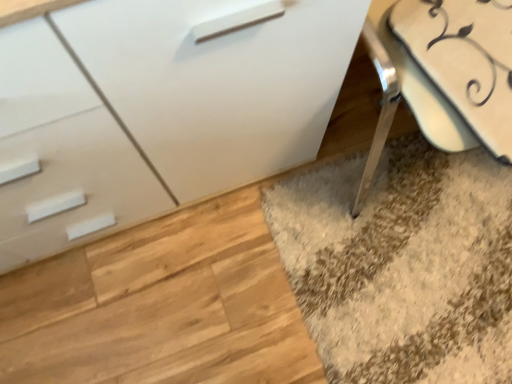
Where is `white glossy swivel chair at lower right`? This screenshot has height=384, width=512. white glossy swivel chair at lower right is located at coordinates (446, 68).

What do you see at coordinates (446, 68) in the screenshot? I see `white glossy swivel chair at lower right` at bounding box center [446, 68].

Image resolution: width=512 pixels, height=384 pixels. What do you see at coordinates (159, 108) in the screenshot?
I see `white glossy chest of drawers at center` at bounding box center [159, 108].

You are a GUI agent. You are given a task and a screenshot of the screen. Output one action in this format:
    pyautogui.click(x=<x>, y=<y>)
    Task: Click on the white glossy chest of drawers at center
    Image resolution: width=512 pixels, height=384 pixels.
    Given the screenshot: What is the action you would take?
    click(x=159, y=108)

Find the location of a particular element. The image size is (512, 384). white glossy swivel chair at lower right is located at coordinates (446, 68).

Is white glossy chest of drawers at center at the left side of white glossy swivel chair at lower right?

Correct, you'll find white glossy chest of drawers at center to the left of white glossy swivel chair at lower right.

Is white glossy chest of drawers at center further to the viewer compared to white glossy swivel chair at lower right?

No, white glossy chest of drawers at center is in front of white glossy swivel chair at lower right.

Considering the positions of points (12, 253) and (495, 106), is point (12, 253) farther from camera compared to point (495, 106)?

Yes, it is behind point (495, 106).

From the image's perspective, is white glossy chest of drawers at center positioned above or below white glossy swivel chair at lower right?

white glossy chest of drawers at center is situated lower than white glossy swivel chair at lower right in the image.

From a real-world perspective, which is physically above, white glossy chest of drawers at center or white glossy swivel chair at lower right?

From a 3D spatial view, white glossy swivel chair at lower right is above.

Which object is thinner, white glossy chest of drawers at center or white glossy swivel chair at lower right?

white glossy chest of drawers at center.

Who is taller, white glossy chest of drawers at center or white glossy swivel chair at lower right?

white glossy chest of drawers at center is taller.

Considering the sizes of white glossy chest of drawers at center and white glossy swivel chair at lower right in the image, is white glossy chest of drawers at center bigger or smaller than white glossy swivel chair at lower right?

white glossy chest of drawers at center is bigger than white glossy swivel chair at lower right.

Is white glossy chest of drawers at center located outside white glossy swivel chair at lower right?

Yes, white glossy chest of drawers at center is located beyond the bounds of white glossy swivel chair at lower right.

Is white glossy chest of drawers at center positioned far away from white glossy swivel chair at lower right?

No, white glossy chest of drawers at center is not far away from white glossy swivel chair at lower right.

Is white glossy chest of drawers at center facing away from white glossy swivel chair at lower right?

No, white glossy chest of drawers at center is not facing the opposite direction of white glossy swivel chair at lower right.

How much distance is there between white glossy chest of drawers at center and white glossy swivel chair at lower right?

white glossy chest of drawers at center is 14.32 inches from white glossy swivel chair at lower right.

Image resolution: width=512 pixels, height=384 pixels. In order to click on swivel chair on the right of white glossy chest of drawers at center in this screenshot , I will do `click(446, 68)`.

Can you confirm if white glossy swivel chair at lower right is positioned to the left of white glossy chest of drawers at center?

No, white glossy swivel chair at lower right is not to the left of white glossy chest of drawers at center.

Is white glossy swivel chair at lower right positioned before white glossy chest of drawers at center?

That is False.

Is point (386, 89) closer or farther from the camera than point (11, 263)?

Point (386, 89) appears to be closer to the viewer than point (11, 263).

From the image's perspective, relative to white glossy chest of drawers at center, is white glossy swivel chair at lower right above or below?

white glossy swivel chair at lower right is above white glossy chest of drawers at center.

From a real-world perspective, is white glossy swivel chair at lower right physically located above or below white glossy chest of drawers at center?

white glossy swivel chair at lower right is situated higher than white glossy chest of drawers at center in the real world.

Which of these two, white glossy swivel chair at lower right or white glossy chest of drawers at center, is thinner?

white glossy chest of drawers at center.

Between white glossy swivel chair at lower right and white glossy chest of drawers at center, which one has more height?

Standing taller between the two is white glossy chest of drawers at center.

Which of these two, white glossy swivel chair at lower right or white glossy chest of drawers at center, is bigger?

Bigger between the two is white glossy chest of drawers at center.

From the picture: Is white glossy swivel chair at lower right not within white glossy chest of drawers at center?

That's correct, white glossy swivel chair at lower right is outside of white glossy chest of drawers at center.

Is white glossy swivel chair at lower right not close to white glossy chest of drawers at center?

No, white glossy swivel chair at lower right is not far away from white glossy chest of drawers at center.

Is white glossy swivel chair at lower right positioned with its back to white glossy chest of drawers at center?

No.

Measure the distance from white glossy swivel chair at lower right to white glossy chest of drawers at center.

white glossy swivel chair at lower right is 14.32 inches away from white glossy chest of drawers at center.

I want to click on swivel chair behind the white glossy chest of drawers at center, so click(446, 68).

Locate an element on the screen. chest of drawers in front of the white glossy swivel chair at lower right is located at coordinates (159, 108).

The width and height of the screenshot is (512, 384). In order to click on swivel chair lying on the right of white glossy chest of drawers at center in this screenshot , I will do coord(446,68).